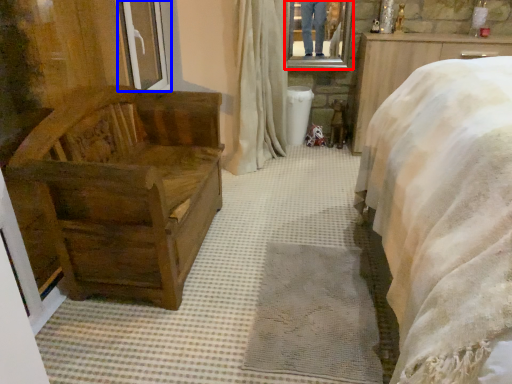
Question: Which of the following is the farthest to the observer, mirror (highlighted by a red box) or window frame (highlighted by a blue box)?

Choices:
 (A) mirror
 (B) window frame

Answer: (A)